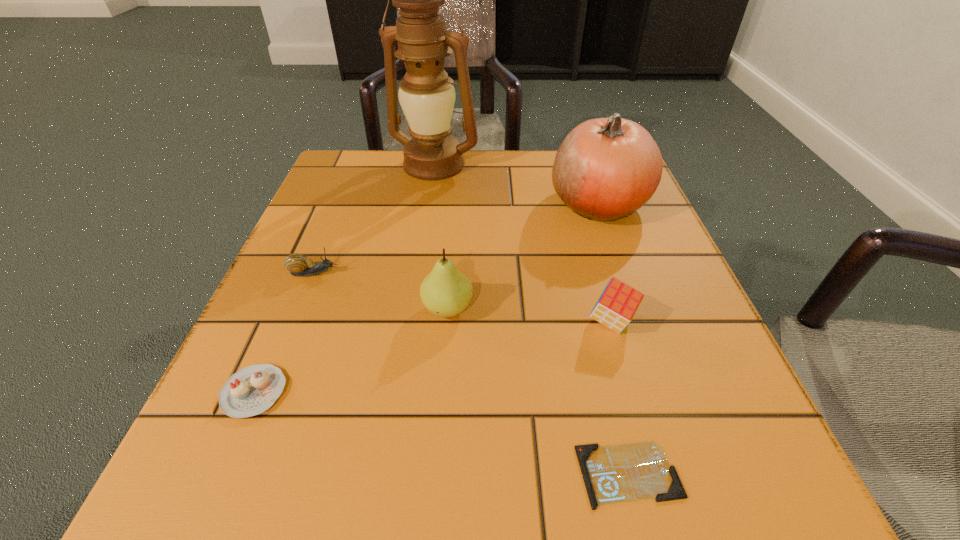
This screenshot has width=960, height=540. I want to click on empty space that is in between the third tallest object and the fourth tallest object, so click(530, 315).

The height and width of the screenshot is (540, 960). Identify the location of free point between the fourth tallest object and the fifth shortest object. (530, 315).

Where is `unoccupied area between the cupcake and the nearest object`? The width and height of the screenshot is (960, 540). unoccupied area between the cupcake and the nearest object is located at coordinates (442, 433).

Find the location of a particular element. Image resolution: width=960 pixels, height=540 pixels. free spot between the pumpkin and the oil lamp is located at coordinates (516, 184).

Find the location of a particular element. vacant area between the second shortest object and the nearest object is located at coordinates (442, 433).

Locate an element on the screen. the fifth closest object relative to the fifth tallest object is located at coordinates pyautogui.click(x=618, y=303).

This screenshot has height=540, width=960. Identify the location of object that is the second closest to the oil lamp. (299, 265).

You are a GUI agent. You are given a task and a screenshot of the screen. Output one action in this format:
    pyautogui.click(x=<x>, y=<y>)
    Task: Click on the vacant position in the image that satisfies the following two spatial constraints: 1. on the back side of the identity card; 2. on the front-facing side of the escargot
    This screenshot has width=960, height=540.
    Given the screenshot: What is the action you would take?
    pyautogui.click(x=580, y=273)

Locate an element on the screen. The width and height of the screenshot is (960, 540). free space in the image that satisfies the following two spatial constraints: 1. on the front-facing side of the escargot; 2. on the right side of the nearest object is located at coordinates (231, 474).

Image resolution: width=960 pixels, height=540 pixels. What are the coordinates of `free point that satisfies the following two spatial constraints: 1. on the front-facing side of the escargot; 2. on the right side of the identity card` in the screenshot? It's located at (231, 474).